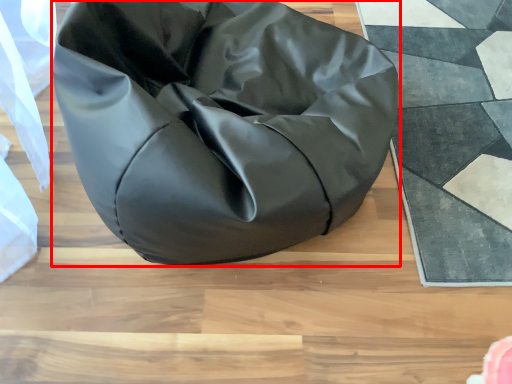
Question: From the image's perspective, where is furniture (annotated by the red box) located in relation to mat in the image?

Choices:
 (A) above
 (B) below

Answer: (A)